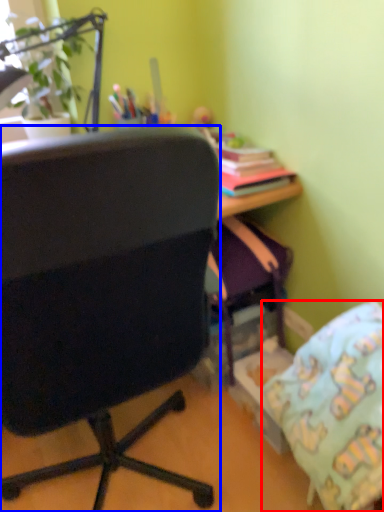
Question: Which point is closer to the camera, pillow (highlighted by a red box) or chair (highlighted by a blue box)?

Choices:
 (A) pillow
 (B) chair

Answer: (B)